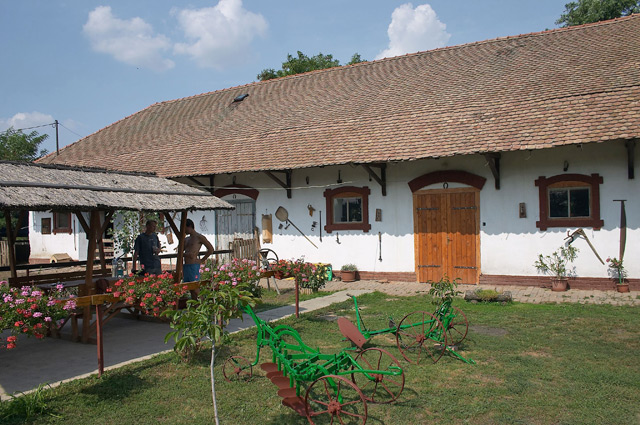
The width and height of the screenshot is (640, 425). I want to click on plant pots, so click(x=623, y=285), click(x=557, y=287), click(x=352, y=275).